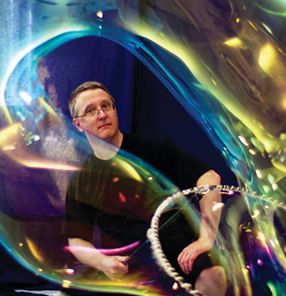
Where is `light`? light is located at coordinates (263, 48).